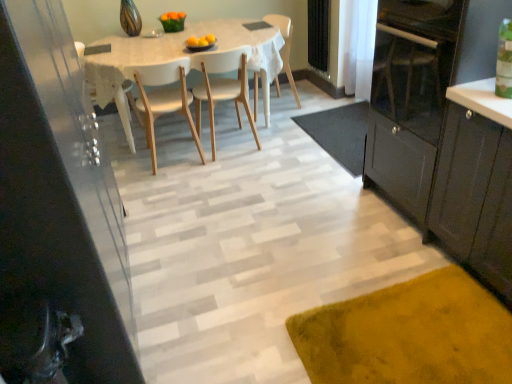
Find the location of `vacant area on top of velvety yellow rug at lower right, positioned as the second doormat in back-to-front order (from a real-world perspective)`. vacant area on top of velvety yellow rug at lower right, positioned as the second doormat in back-to-front order (from a real-world perspective) is located at coordinates (409, 326).